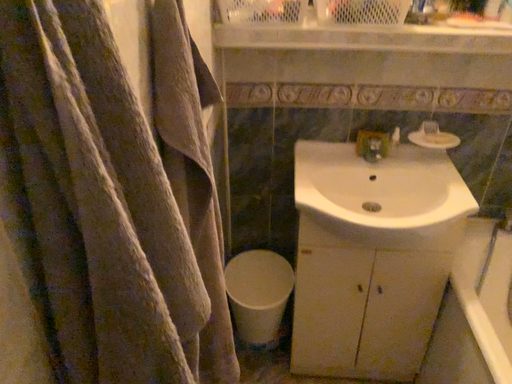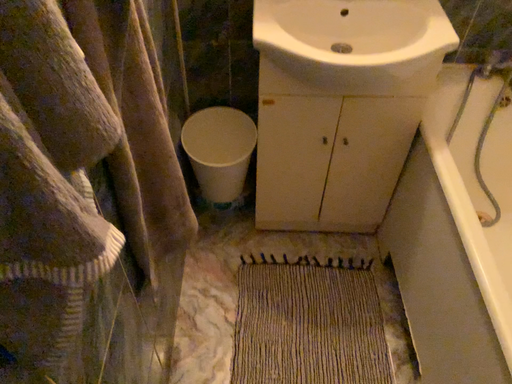
Question: Which way did the camera rotate in the video?

Choices:
 (A) rotated downward
 (B) rotated upward

Answer: (A)